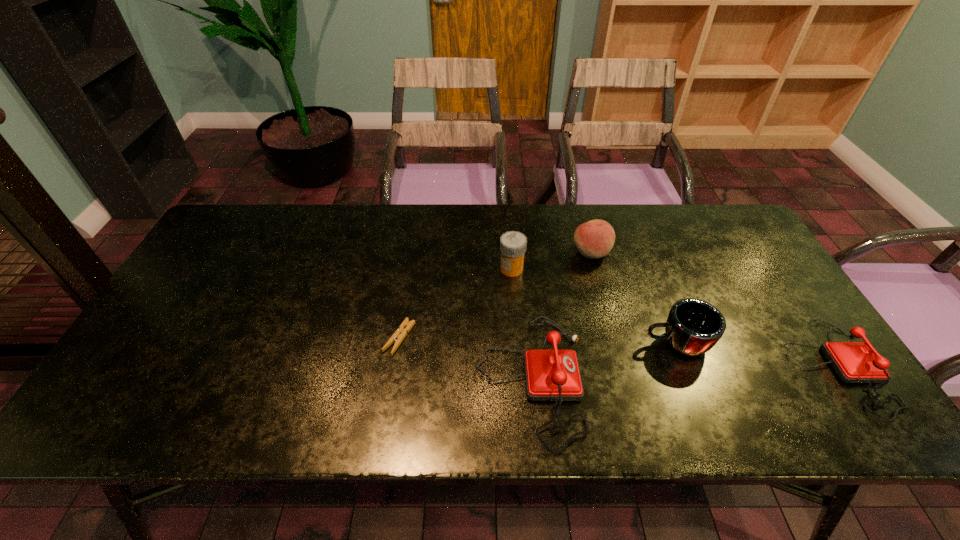
This screenshot has height=540, width=960. I want to click on blank region between the medicine and the third object from right to left, so click(x=552, y=261).

I want to click on vacant space in between the left telephone and the rightmost object, so click(x=684, y=372).

The image size is (960, 540). What are the coordinates of `free space between the peach and the second object from right to left` in the screenshot? It's located at (634, 298).

You are a GUI agent. You are given a task and a screenshot of the screen. Output one action in this format:
    pyautogui.click(x=<x>, y=<y>)
    Task: Click on the free space between the mug and the fourth object from left to right
    The height and width of the screenshot is (540, 960).
    Given the screenshot: What is the action you would take?
    pyautogui.click(x=634, y=298)

Image resolution: width=960 pixels, height=540 pixels. Find the location of `vacant area that lies between the shortest object and the third object from right to left`. vacant area that lies between the shortest object and the third object from right to left is located at coordinates tap(495, 295).

Find the location of a particular element. The width and height of the screenshot is (960, 540). empty space that is in between the left telephone and the medicine is located at coordinates (521, 324).

Identify the location of empty space that is in between the shortest object and the shorter telephone. (617, 352).

This screenshot has width=960, height=540. I want to click on object that ranks as the second closest to the mug, so click(x=855, y=362).

Where is `object that is the second closest one to the mug`? The image size is (960, 540). object that is the second closest one to the mug is located at coordinates (855, 362).

Where is `vacant space that satisfies the following two spatial constraints: 1. on the front side of the fourth object from left to right; 2. on the label side of the medicine`? vacant space that satisfies the following two spatial constraints: 1. on the front side of the fourth object from left to right; 2. on the label side of the medicine is located at coordinates (596, 269).